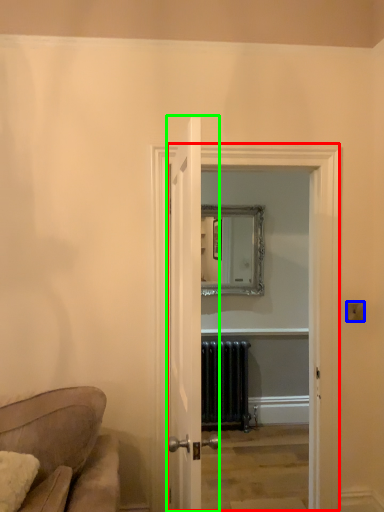
Question: Which object is the farthest from glass door (highlighted by a red box)? Choose among these: light switch (highlighted by a blue box) or door (highlighted by a green box).

Choices:
 (A) light switch
 (B) door

Answer: (B)